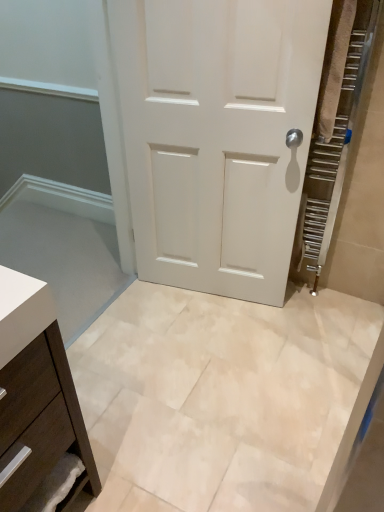
Question: Can you confirm if beige marble tile at center is thinner than white matte door at center?

Choices:
 (A) no
 (B) yes

Answer: (A)

Question: Does beige marble tile at center have a greater width compared to white matte door at center?

Choices:
 (A) no
 (B) yes

Answer: (B)

Question: Does beige marble tile at center have a lesser height compared to white matte door at center?

Choices:
 (A) yes
 (B) no

Answer: (A)

Question: Can you confirm if beige marble tile at center is positioned to the right of white matte door at center?

Choices:
 (A) yes
 (B) no

Answer: (B)

Question: Can we say beige marble tile at center lies outside white matte door at center?

Choices:
 (A) yes
 (B) no

Answer: (A)

Question: Is beige marble tile at center behind white matte door at center?

Choices:
 (A) no
 (B) yes

Answer: (A)

Question: Is white matte door at center surrounded by matte brown drawer at lower left?

Choices:
 (A) yes
 (B) no

Answer: (B)

Question: Is matte brown drawer at lower left positioned with its back to white matte door at center?

Choices:
 (A) no
 (B) yes

Answer: (A)

Question: From a real-world perspective, is matte brown drawer at lower left on top of white matte door at center?

Choices:
 (A) yes
 (B) no

Answer: (B)

Question: Does matte brown drawer at lower left have a greater width compared to white matte door at center?

Choices:
 (A) yes
 (B) no

Answer: (A)

Question: Would you consider matte brown drawer at lower left to be distant from white matte door at center?

Choices:
 (A) no
 (B) yes

Answer: (B)

Question: Does matte brown drawer at lower left turn towards white matte door at center?

Choices:
 (A) no
 (B) yes

Answer: (A)

Question: Is matte brown drawer at lower left not within beige marble tile at center?

Choices:
 (A) yes
 (B) no

Answer: (A)